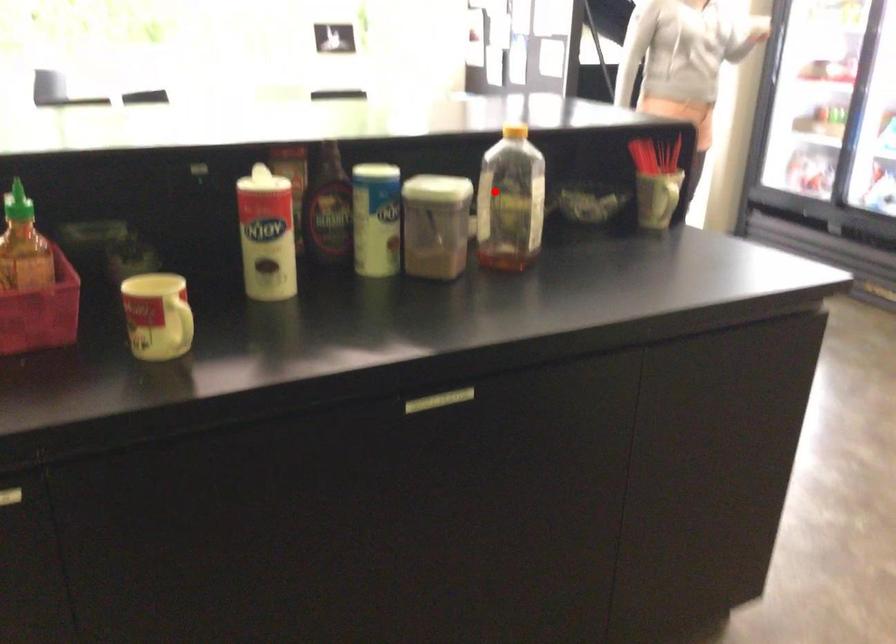
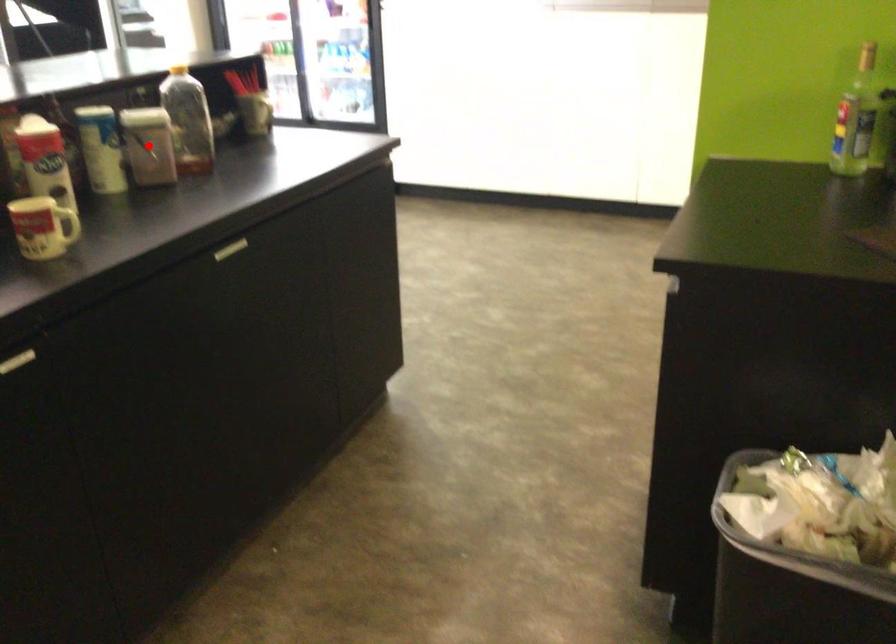
I am providing you with two images of the same scene from different viewpoints. A red point is marked on the first image and another point is marked on the second image. Is the red point in image1 aligned with the point shown in image2?

No